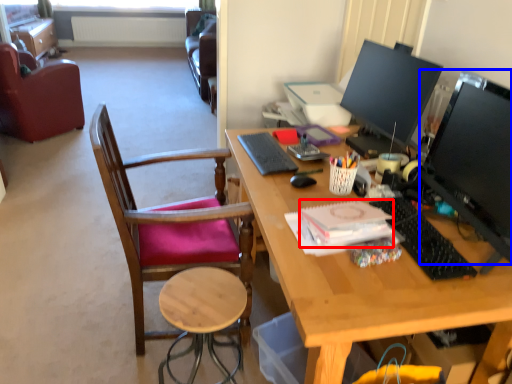
Question: Which object is further to the camera taking this photo, notepad (highlighted by a red box) or television (highlighted by a blue box)?

Choices:
 (A) notepad
 (B) television

Answer: (A)